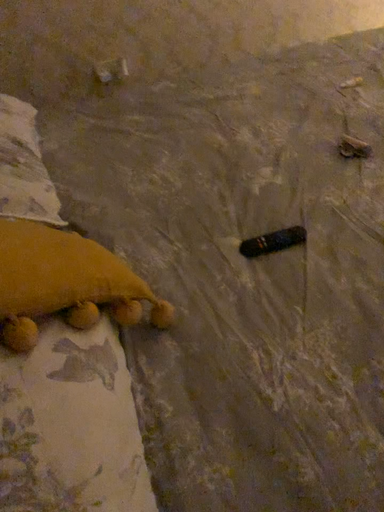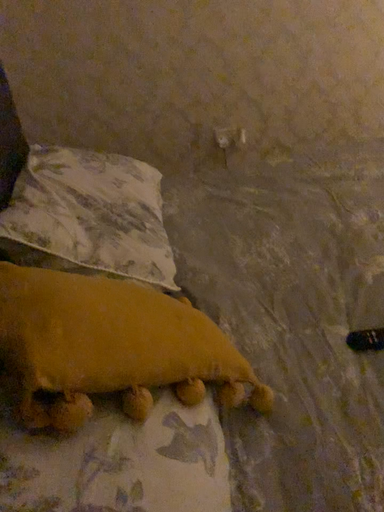
Question: How did the camera likely rotate when shooting the video?

Choices:
 (A) rotated left
 (B) rotated right

Answer: (A)